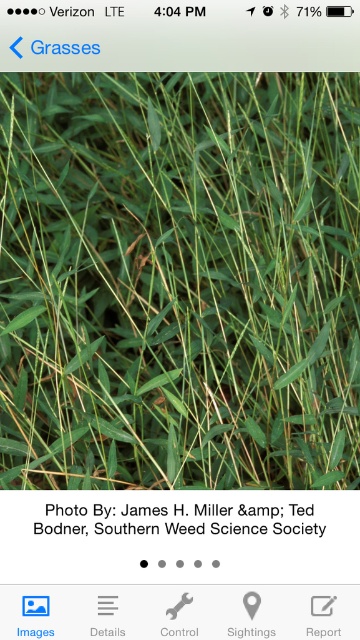
Question: Can you confirm if green matte grass at center is positioned below black paper at center?

Choices:
 (A) no
 (B) yes

Answer: (A)

Question: Which of the following is the closest to the observer?

Choices:
 (A) green matte grass at center
 (B) black paper at center

Answer: (B)

Question: Which of the following is the closest to the observer?

Choices:
 (A) (2, 433)
 (B) (218, 528)

Answer: (B)

Question: In this image, where is green matte grass at center located relative to black paper at center?

Choices:
 (A) right
 (B) left

Answer: (A)

Question: Is green matte grass at center to the right of black paper at center from the viewer's perspective?

Choices:
 (A) no
 (B) yes

Answer: (B)